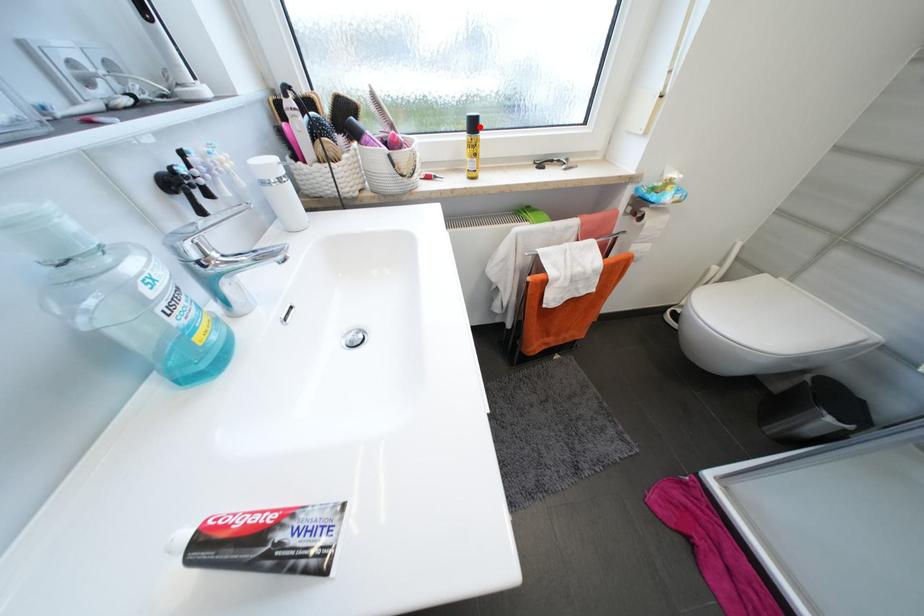
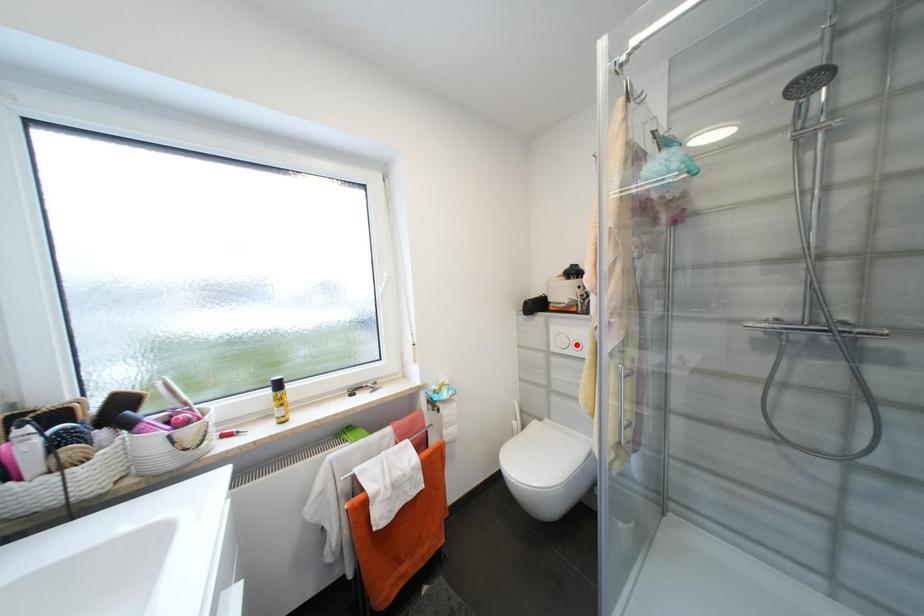
I am providing you with two images of the same scene from different viewpoints. A red point is marked on the first image and another point is marked on the second image. Do the highlighted points in image1 and image2 indicate the same real-world spot?

No